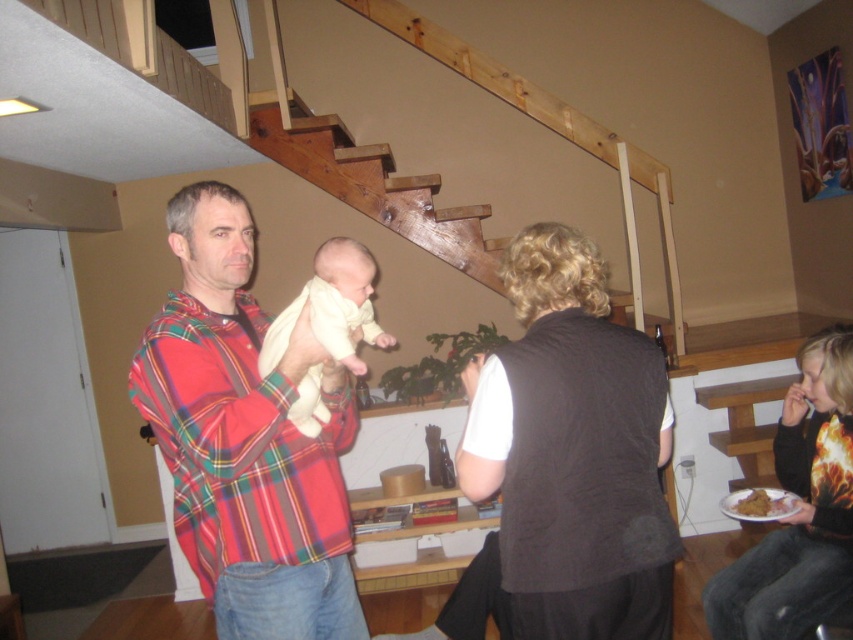
Question: In this image, where is dark gray vest at center located relative to golden crispy chicken at lower right?

Choices:
 (A) left
 (B) right

Answer: (A)

Question: Considering the real-world distances, which object is closest to the plaid shirt at center?

Choices:
 (A) dark gray vest at center
 (B) golden crispy chicken at lower right

Answer: (A)

Question: Among these objects, which one is nearest to the camera?

Choices:
 (A) golden crispy chicken at lower right
 (B) floral shirt at lower right

Answer: (B)

Question: Is the position of plaid shirt at center more distant than that of white clothed baby at center?

Choices:
 (A) no
 (B) yes

Answer: (A)

Question: Considering the real-world distances, which object is farthest from the plaid shirt at center?

Choices:
 (A) floral shirt at lower right
 (B) golden crispy chicken at lower right

Answer: (B)

Question: Is dark gray vest at center further to camera compared to plaid shirt at center?

Choices:
 (A) no
 (B) yes

Answer: (B)